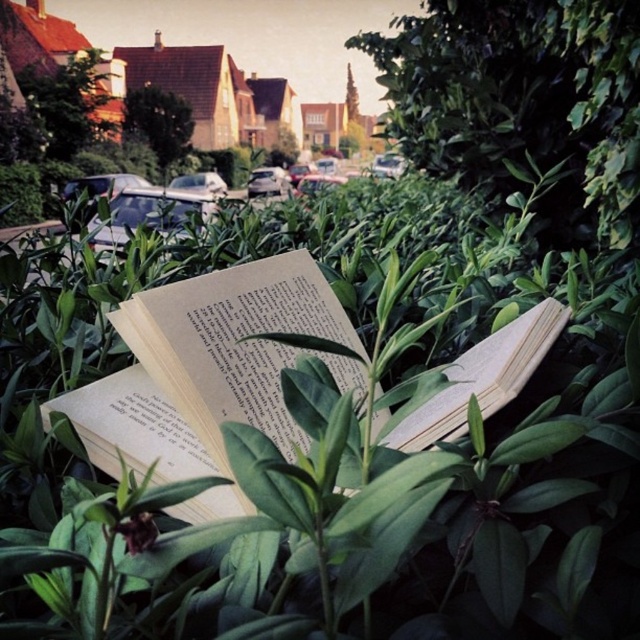
Question: Does metallic silver car at center come behind silver metallic car at center?

Choices:
 (A) yes
 (B) no

Answer: (B)

Question: Which object appears farthest from the camera in this image?

Choices:
 (A) beige paper book at center
 (B) metallic silver car at center

Answer: (B)

Question: Does beige paper book at center come behind metallic silver car at center?

Choices:
 (A) no
 (B) yes

Answer: (A)

Question: Can you confirm if beige paper book at center is wider than silver metallic car at center?

Choices:
 (A) yes
 (B) no

Answer: (B)

Question: Estimate the real-world distances between objects in this image. Which object is farther from the beige paper book at center?

Choices:
 (A) silver metallic car at center
 (B) metallic silver car at center

Answer: (A)

Question: Which point is farther to the camera?

Choices:
 (A) beige paper book at center
 (B) silver metallic car at center
 (C) metallic silver car at center

Answer: (B)